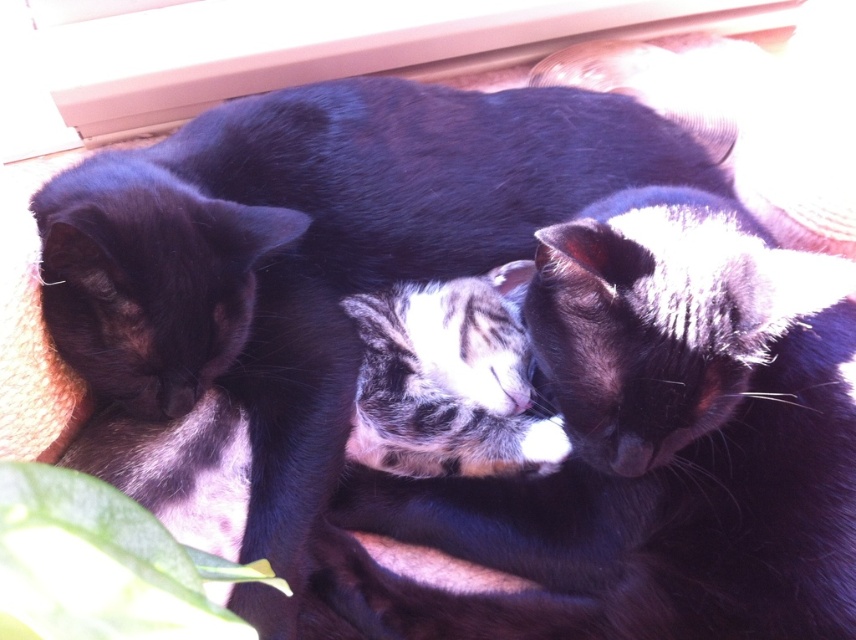
You are a cat owner who wants to place a new cat tree in the room. The cat tree is 1.2 meters wide. You see the smooth wood window sill at upper center and the green leafy plant at lower left. Which object has a wider width that could accommodate the cat tree?

The smooth wood window sill at upper center has a wider width than the green leafy plant at lower left, so it can accommodate the cat tree.

You are a cat owner who wants to place a new cat bed on the smooth wood window sill at upper center or the green leafy plant at lower left. Which surface can accommodate a larger cat bed?

The smooth wood window sill at upper center is bigger than the green leafy plant at lower left, so it can accommodate a larger cat bed.

You are a cat owner who wants to ensure all three cats are within a safe distance from each other to prevent any accidental harm. Given that the cats are positioned at point (598, 10), what is the minimum distance you should maintain between them?

The minimum distance you should maintain between the cats is 1.40 meters to ensure their safety.